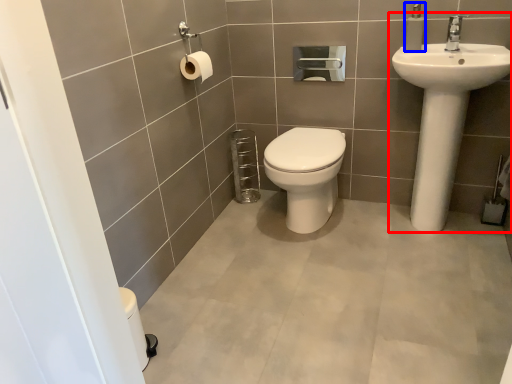
Question: Which point is closer to the camera, sink (highlighted by a red box) or soap dispenser (highlighted by a blue box)?

Choices:
 (A) sink
 (B) soap dispenser

Answer: (A)